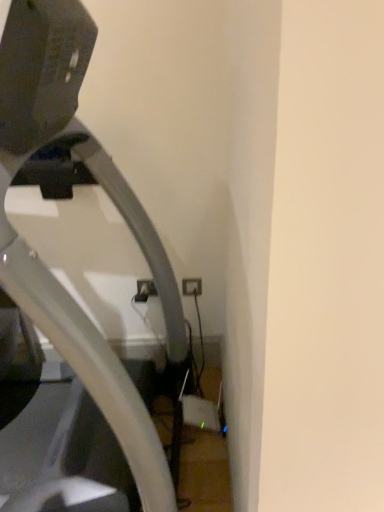
Describe the element at coordinates (192, 286) in the screenshot. The width and height of the screenshot is (384, 512). I see `white plastic electric outlet at lower center` at that location.

Where is `white plastic electric outlet at lower center`? white plastic electric outlet at lower center is located at coordinates (192, 286).

Describe the element at coordinates (112, 201) in the screenshot. This screenshot has height=512, width=384. I see `metallic gray treadmill at left` at that location.

You are a GUI agent. You are given a task and a screenshot of the screen. Output one action in this format:
    pyautogui.click(x=<x>, y=<y>)
    Task: Click on the metallic gray treadmill at left
    
    Given the screenshot: What is the action you would take?
    pyautogui.click(x=112, y=201)

At what (x,y) coordinates should I click in order to perform the action: click on white plastic electric outlet at lower center. Please return your answer as a coordinate pair (x, y). This screenshot has height=512, width=384. Looking at the image, I should click on (192, 286).

Considering the positions of objects metallic gray treadmill at left and white plastic electric outlet at lower center in the image provided, who is more to the right, metallic gray treadmill at left or white plastic electric outlet at lower center?

white plastic electric outlet at lower center.

From the picture: Does metallic gray treadmill at left come behind white plastic electric outlet at lower center?

No, it is not.

Between point (151, 232) and point (197, 285), which one is positioned behind?

Positioned behind is point (197, 285).

From the image's perspective, is metallic gray treadmill at left located beneath white plastic electric outlet at lower center?

Actually, metallic gray treadmill at left appears above white plastic electric outlet at lower center in the image.

Based on the photo, from a real-world perspective, who is located higher, metallic gray treadmill at left or white plastic electric outlet at lower center?

metallic gray treadmill at left.

Is metallic gray treadmill at left wider or thinner than white plastic electric outlet at lower center?

Considering their sizes, metallic gray treadmill at left looks broader than white plastic electric outlet at lower center.

Consider the image. Considering the relative sizes of metallic gray treadmill at left and white plastic electric outlet at lower center in the image provided, is metallic gray treadmill at left taller than white plastic electric outlet at lower center?

Yes.

Is metallic gray treadmill at left bigger or smaller than white plastic electric outlet at lower center?

Considering their sizes, metallic gray treadmill at left takes up more space than white plastic electric outlet at lower center.

Is metallic gray treadmill at left outside of white plastic electric outlet at lower center?

Yes, metallic gray treadmill at left is not within white plastic electric outlet at lower center.

Is the surface of metallic gray treadmill at left in direct contact with white plastic electric outlet at lower center?

No, metallic gray treadmill at left is not touching white plastic electric outlet at lower center.

Is metallic gray treadmill at left positioned with its back to white plastic electric outlet at lower center?

No.

Measure the distance from metallic gray treadmill at left to white plastic electric outlet at lower center.

They are 30.12 inches apart.

Locate an element on the screen. treadmill located in front of the white plastic electric outlet at lower center is located at coordinates (112, 201).

Considering the positions of objects white plastic electric outlet at lower center and metallic gray treadmill at left in the image provided, who is more to the right, white plastic electric outlet at lower center or metallic gray treadmill at left?

Positioned to the right is white plastic electric outlet at lower center.

Between white plastic electric outlet at lower center and metallic gray treadmill at left, which one is positioned in front?

Positioned in front is metallic gray treadmill at left.

Which is closer to the camera, (x=191, y=280) or (x=77, y=36)?

Point (x=191, y=280) appears to be farther away from the viewer than point (x=77, y=36).

From the image's perspective, does white plastic electric outlet at lower center appear lower than metallic gray treadmill at left?

Correct, white plastic electric outlet at lower center appears lower than metallic gray treadmill at left in the image.

From a real-world perspective, is white plastic electric outlet at lower center located beneath metallic gray treadmill at left?

Yes, from a real-world perspective, white plastic electric outlet at lower center is under metallic gray treadmill at left.

Which object is thinner, white plastic electric outlet at lower center or metallic gray treadmill at left?

white plastic electric outlet at lower center is thinner.

Looking at this image, does white plastic electric outlet at lower center have a lesser height compared to metallic gray treadmill at left?

Indeed, white plastic electric outlet at lower center has a lesser height compared to metallic gray treadmill at left.

Can you confirm if white plastic electric outlet at lower center is bigger than metallic gray treadmill at left?

No.

Choose the correct answer: Is white plastic electric outlet at lower center inside metallic gray treadmill at left or outside it?

The correct answer is: outside.

Is white plastic electric outlet at lower center not close to metallic gray treadmill at left?

No, white plastic electric outlet at lower center is not far away from metallic gray treadmill at left.

Does white plastic electric outlet at lower center turn towards metallic gray treadmill at left?

Yes, white plastic electric outlet at lower center is facing metallic gray treadmill at left.

What's the angular difference between white plastic electric outlet at lower center and metallic gray treadmill at left's facing directions?

1.23 degrees separate the facing orientations of white plastic electric outlet at lower center and metallic gray treadmill at left.

Could you measure the distance between white plastic electric outlet at lower center and metallic gray treadmill at left?

A distance of 30.12 inches exists between white plastic electric outlet at lower center and metallic gray treadmill at left.

Where is `treadmill that appears in front of the white plastic electric outlet at lower center`? This screenshot has height=512, width=384. treadmill that appears in front of the white plastic electric outlet at lower center is located at coordinates (112, 201).

The height and width of the screenshot is (512, 384). Find the location of `treadmill located above the white plastic electric outlet at lower center (from a real-world perspective)`. treadmill located above the white plastic electric outlet at lower center (from a real-world perspective) is located at coordinates (112, 201).

In the image, there is a white plastic electric outlet at lower center. At what (x,y) coordinates should I click in order to perform the action: click on treadmill above it (from the image's perspective). Please return your answer as a coordinate pair (x, y). The width and height of the screenshot is (384, 512). Looking at the image, I should click on (112, 201).